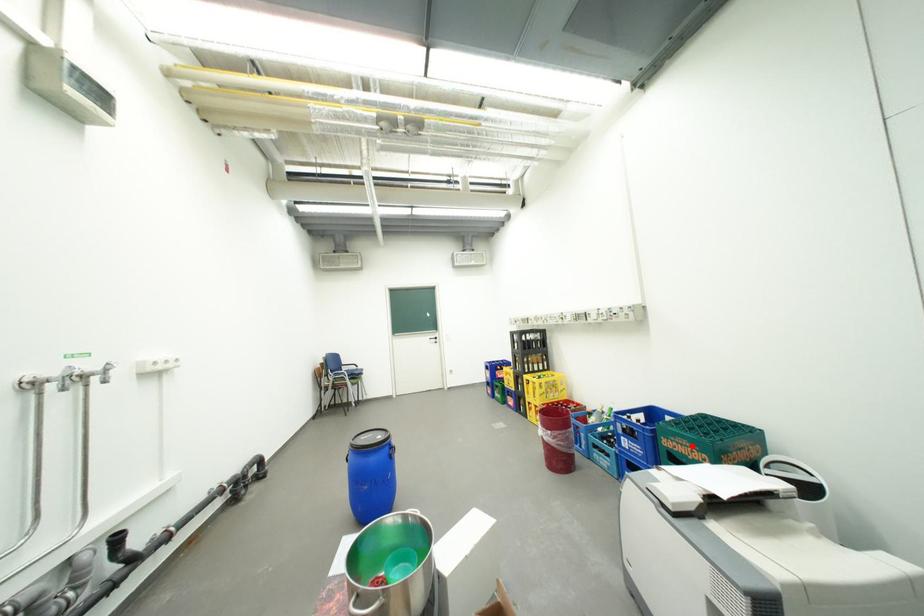
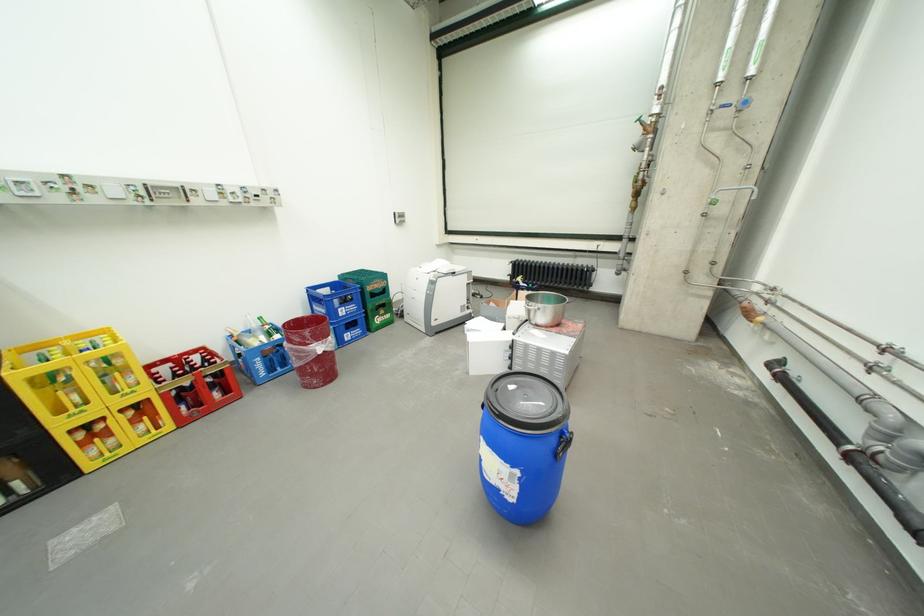
Question: I am providing you with two images of the same scene from different viewpoints. Given a red point in image1, look at the same physical point in image2. Is it:

Choices:
 (A) Closer to the viewpoint
 (B) Farther from the viewpoint

Answer: (A)